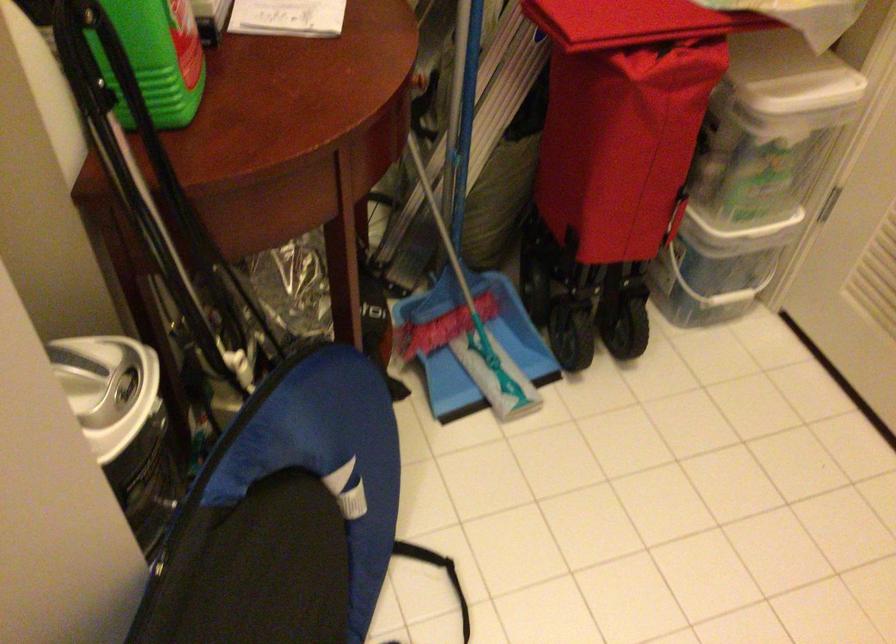
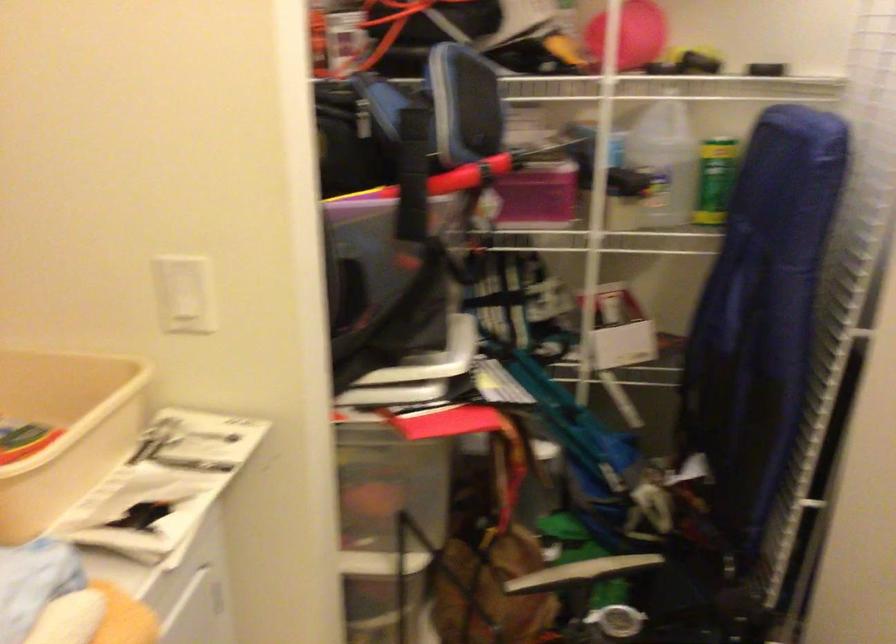
The first image is from the beginning of the video and the second image is from the end. How did the camera likely rotate when shooting the video?

The rotation direction of the camera is left-down.